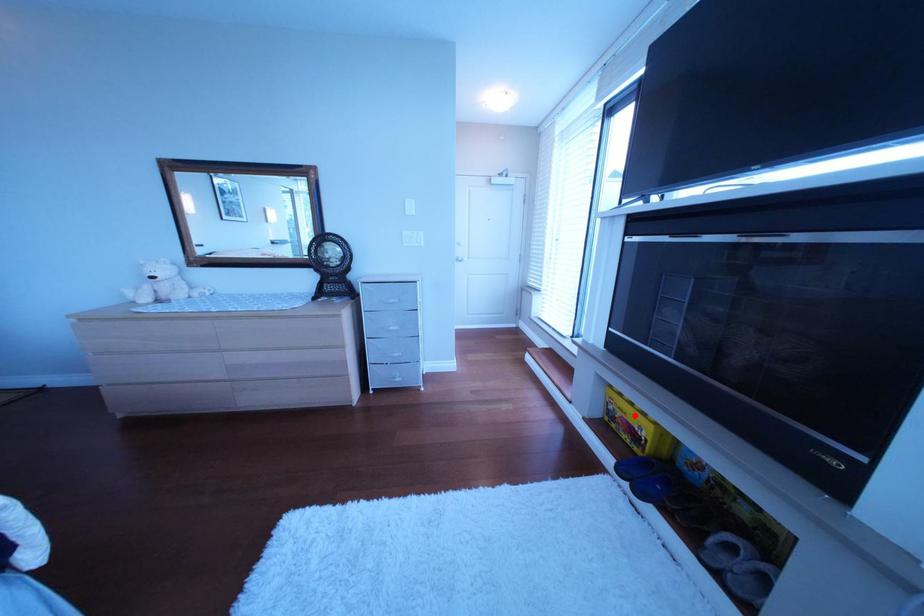
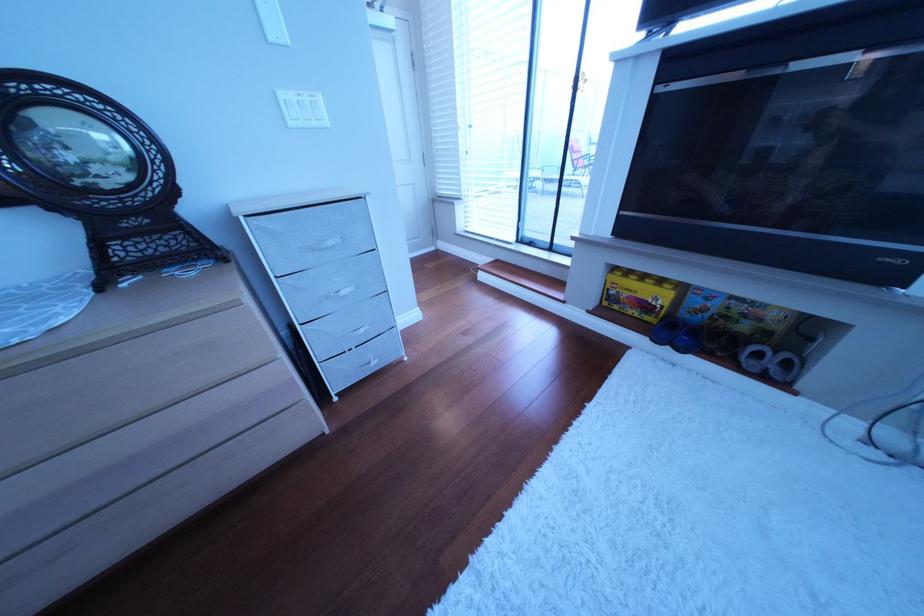
Where in the second image is the point corresponding to the highlighted location from the first image?

(640, 296)